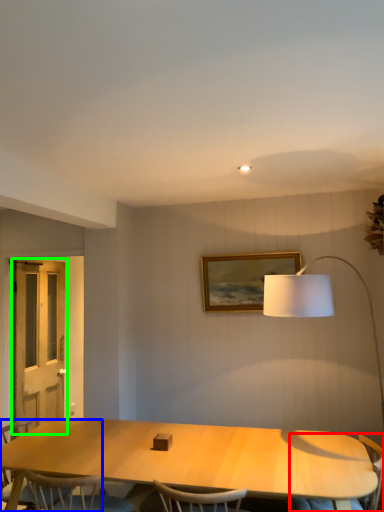
Question: Estimate the real-world distances between objects in this image. Which object is closer to armchair (highlighted by a red box), chair (highlighted by a blue box) or screen door (highlighted by a green box)?

Choices:
 (A) chair
 (B) screen door

Answer: (A)